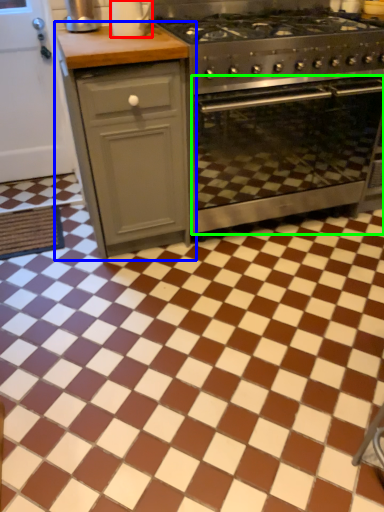
Question: Based on their relative distances, which object is nearer to kitchen appliance (highlighted by a red box)? Choose from cabinetry (highlighted by a blue box) and oven (highlighted by a green box).

Choices:
 (A) cabinetry
 (B) oven

Answer: (A)